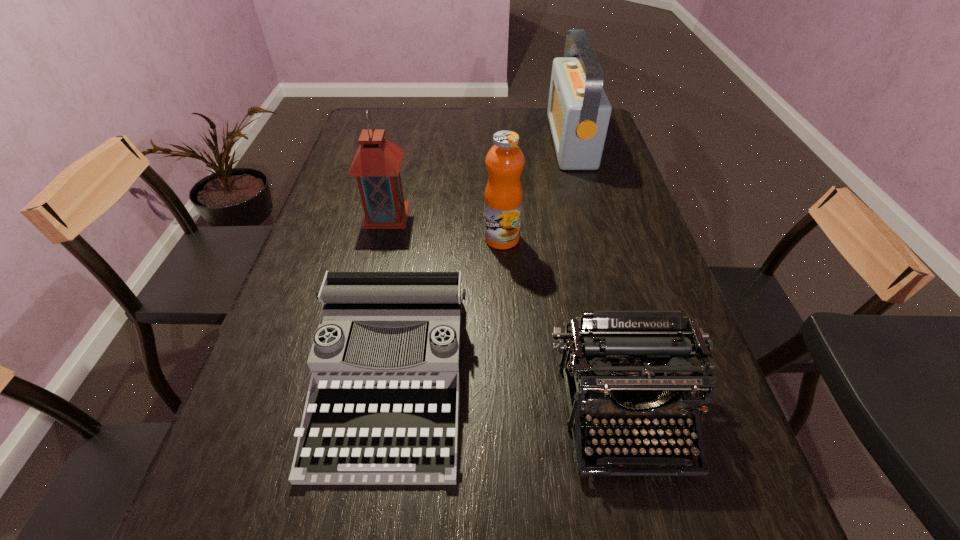
This screenshot has width=960, height=540. I want to click on object that stands as the second closest to the radio receiver, so click(376, 164).

Identify which object is the third nearest to the third object from left to right. Please provide its 2D coordinates. Your answer should be formatted as a tuple, i.e. [(x, y)], where the tuple contains the x and y coordinates of a point satisfying the conditions above.

[(579, 111)]

Image resolution: width=960 pixels, height=540 pixels. In order to click on vacant space that satisfies the following two spatial constraints: 1. on the front side of the lantern; 2. on the left side of the fruit juice in this screenshot , I will do click(x=381, y=239).

The width and height of the screenshot is (960, 540). In order to click on vacant space that satisfies the following two spatial constraints: 1. on the front-facing side of the farthest object; 2. on the typing side of the shorter typewriter in this screenshot , I will do `click(637, 379)`.